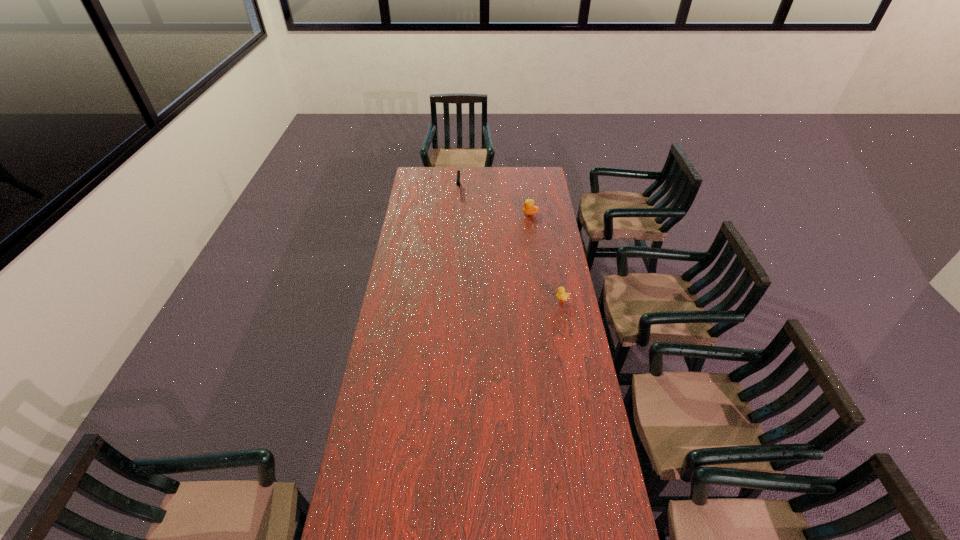
Locate an element on the screen. the farthest object is located at coordinates (458, 183).

Locate an element on the screen. The height and width of the screenshot is (540, 960). pistol is located at coordinates (458, 183).

Identify the location of the left duckling. (529, 208).

The width and height of the screenshot is (960, 540). I want to click on the second farthest object, so click(529, 208).

At what (x,y) coordinates should I click in order to perform the action: click on the right duckling. Please return your answer as a coordinate pair (x, y). Looking at the image, I should click on (561, 295).

This screenshot has width=960, height=540. What are the coordinates of `the shorter duckling` in the screenshot? It's located at (561, 295).

The image size is (960, 540). Identify the location of free space located 0.280m on the front-facing side of the farthest object. (457, 224).

Locate an element on the screen. free region located 0.180m on the face of the left duckling is located at coordinates (491, 214).

Identify the location of free location located on the face of the left duckling. The width and height of the screenshot is (960, 540). (508, 214).

At what (x,y) coordinates should I click in order to perform the action: click on free space located 0.310m on the face of the left duckling. Please return your answer as a coordinate pair (x, y). Looking at the image, I should click on (468, 214).